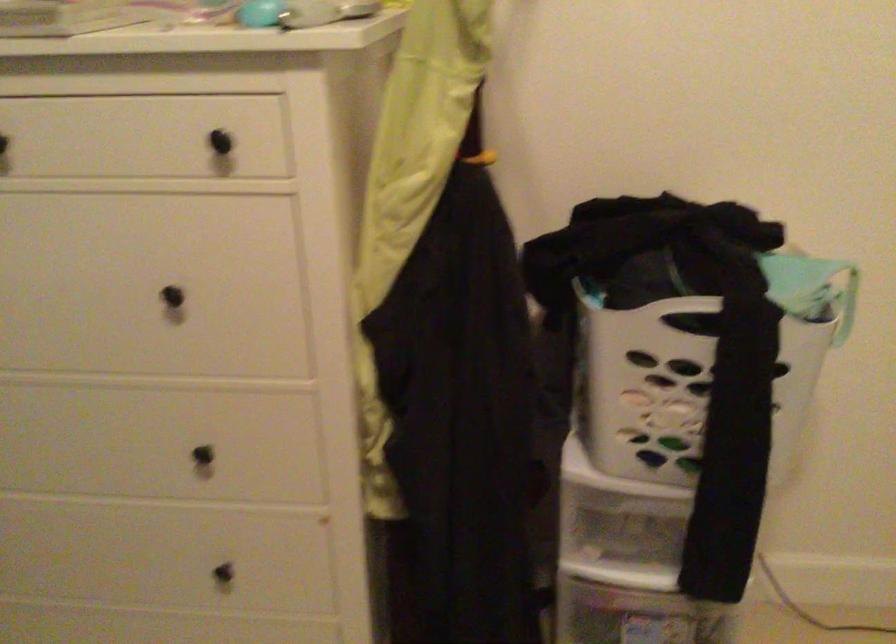
This screenshot has width=896, height=644. What are the coordinates of `laundry basket handle` in the screenshot? It's located at (825, 261).